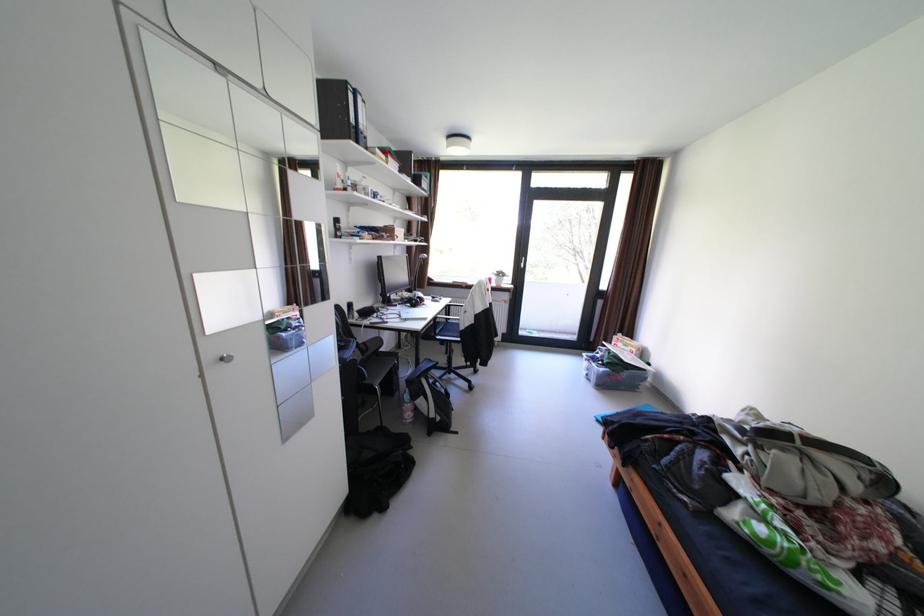
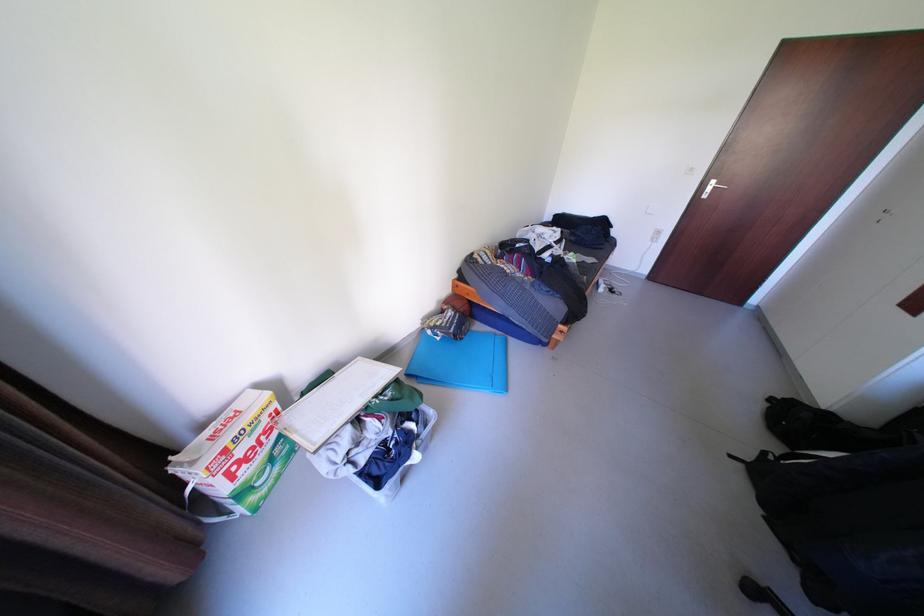
Locate, in the second image, the point that corresponds to pixel 464 430 in the first image.

(752, 466)